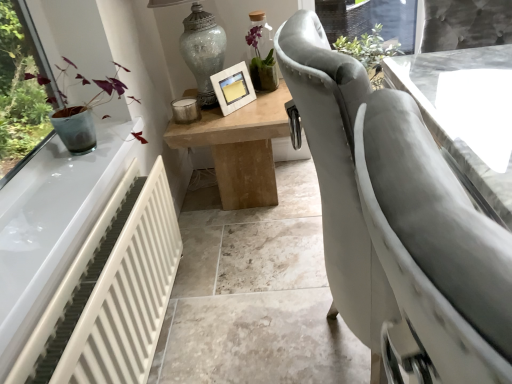
Question: Is white glossy table at center, positioned as the 2th table in left-to-right order, positioned with its back to crackle glass vase at upper center?

Choices:
 (A) no
 (B) yes

Answer: (A)

Question: From the image's perspective, is white glossy table at center, positioned as the 2th table in left-to-right order, located beneath crackle glass vase at upper center?

Choices:
 (A) yes
 (B) no

Answer: (A)

Question: Is white glossy table at center, arranged as the first table when viewed from the right, placed right next to crackle glass vase at upper center?

Choices:
 (A) no
 (B) yes

Answer: (A)

Question: Is white glossy table at center, arranged as the first table when viewed from the right, smaller than crackle glass vase at upper center?

Choices:
 (A) yes
 (B) no

Answer: (B)

Question: Can you confirm if white glossy table at center, positioned as the 2th table in left-to-right order, is thinner than crackle glass vase at upper center?

Choices:
 (A) no
 (B) yes

Answer: (A)

Question: Is point (223, 127) positioned closer to the camera than point (215, 28)?

Choices:
 (A) closer
 (B) farther

Answer: (A)

Question: Is light brown wooden table at center, placed as the 2th table when sorted from right to left, in front of or behind crackle glass vase at upper center in the image?

Choices:
 (A) front
 (B) behind

Answer: (B)

Question: Would you say light brown wooden table at center, which is the first table from left to right, is to the left or to the right of crackle glass vase at upper center in the picture?

Choices:
 (A) right
 (B) left

Answer: (A)

Question: Considering the positions of light brown wooden table at center, which is the first table from left to right, and crackle glass vase at upper center in the image, is light brown wooden table at center, which is the first table from left to right, taller or shorter than crackle glass vase at upper center?

Choices:
 (A) short
 (B) tall

Answer: (A)

Question: Is crackle glass vase at upper center inside or outside of white glossy table at center, arranged as the first table when viewed from the right?

Choices:
 (A) outside
 (B) inside

Answer: (A)

Question: In terms of height, does crackle glass vase at upper center look taller or shorter compared to white glossy table at center, arranged as the first table when viewed from the right?

Choices:
 (A) short
 (B) tall

Answer: (A)

Question: Is point (202, 31) closer or farther from the camera than point (407, 71)?

Choices:
 (A) closer
 (B) farther

Answer: (B)

Question: Is crackle glass vase at upper center in front of or behind white glossy table at center, positioned as the 2th table in left-to-right order, in the image?

Choices:
 (A) behind
 (B) front

Answer: (A)

Question: In the image, is white glossy table at center, arranged as the first table when viewed from the right, positioned in front of or behind light brown wooden table at center, placed as the 2th table when sorted from right to left?

Choices:
 (A) front
 (B) behind

Answer: (A)

Question: In terms of width, does white glossy table at center, arranged as the first table when viewed from the right, look wider or thinner when compared to light brown wooden table at center, which is the first table from left to right?

Choices:
 (A) thin
 (B) wide

Answer: (B)